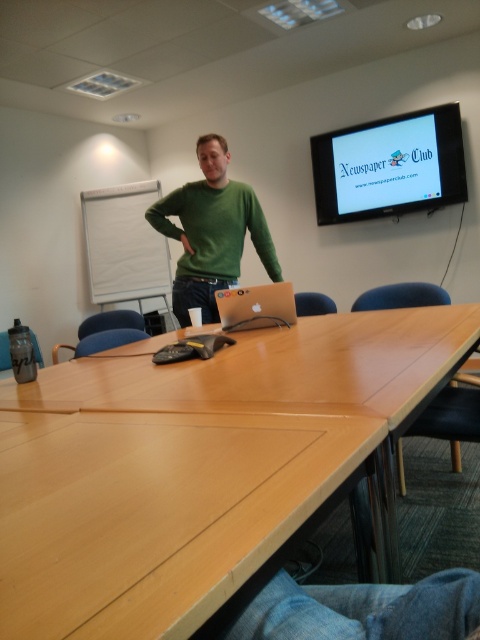
Looking at this image, which is below, light brown wood table at center or green matte sweater at center?

light brown wood table at center

Between light brown wood table at center and green matte sweater at center, which one has less height?

light brown wood table at center

Between point (229, 474) and point (187, 314), which one is positioned in front?

Point (229, 474) is more forward.

Image resolution: width=480 pixels, height=640 pixels. I want to click on light brown wood table at center, so click(x=194, y=465).

Looking at this image, is light brown wood table at center behind matte plastic screen at upper right?

No, it is in front of matte plastic screen at upper right.

Can you confirm if light brown wood table at center is taller than matte plastic screen at upper right?

Incorrect, light brown wood table at center's height is not larger of matte plastic screen at upper right's.

Image resolution: width=480 pixels, height=640 pixels. Identify the location of light brown wood table at center. (194, 465).

Who is shorter, matte plastic screen at upper right or green matte sweater at center?

matte plastic screen at upper right

Which is behind, point (371, 211) or point (193, 241)?

Point (371, 211)

Between point (379, 170) and point (197, 259), which one is positioned in front?

Point (197, 259)

Identify the location of matte plastic screen at upper right. (389, 166).